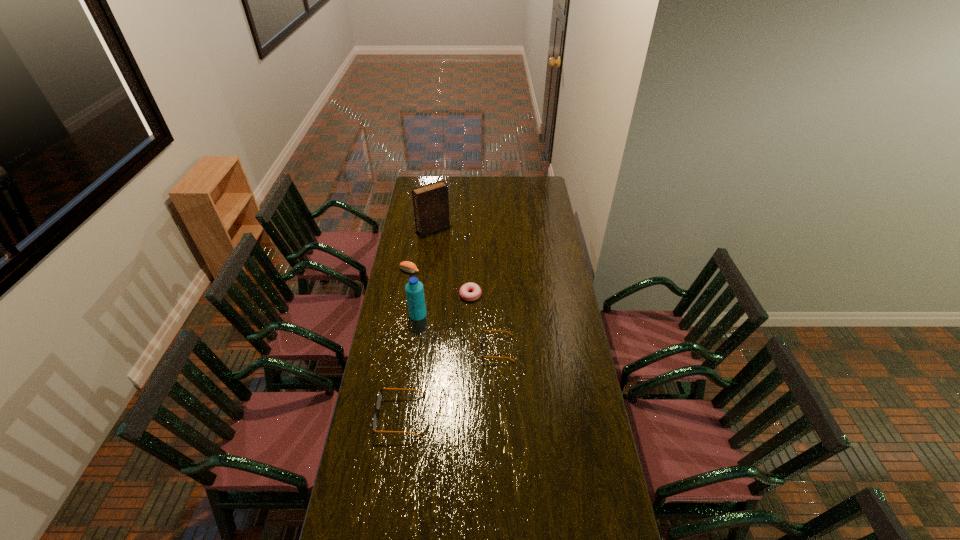
Image resolution: width=960 pixels, height=540 pixels. Find the location of `sushi that is at the left edge`. sushi that is at the left edge is located at coordinates (406, 266).

Locate an element on the screen. The height and width of the screenshot is (540, 960). free region at the far edge is located at coordinates (475, 193).

In order to click on free spot at the near edge of the desktop in this screenshot , I will do `click(416, 537)`.

Image resolution: width=960 pixels, height=540 pixels. I want to click on free space at the left edge, so click(x=367, y=442).

Locate an element on the screen. This screenshot has width=960, height=540. vacant space at the right edge of the desktop is located at coordinates (529, 221).

Locate an element on the screen. vacant space at the far left corner is located at coordinates (416, 179).

Locate an element on the screen. This screenshot has height=540, width=960. vacant space at the far right corner of the desktop is located at coordinates (x=547, y=191).

This screenshot has width=960, height=540. I want to click on free space between the tallest object and the second farthest object, so click(x=421, y=249).

The height and width of the screenshot is (540, 960). I want to click on empty location between the third nearest object and the doughnut, so click(x=444, y=305).

Image resolution: width=960 pixels, height=540 pixels. I want to click on free space that is in between the sushi and the tallest object, so click(421, 249).